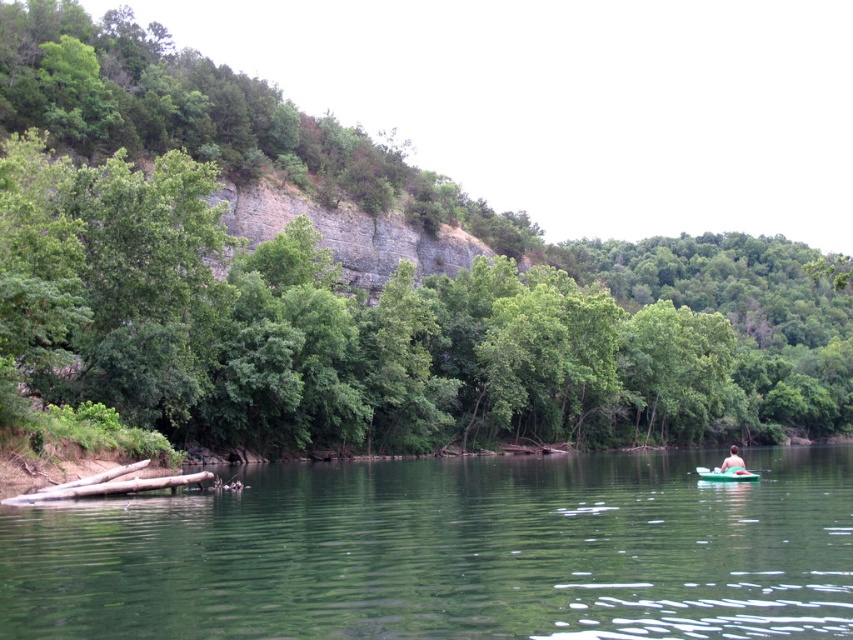
The height and width of the screenshot is (640, 853). What are the coordinates of `green leafy tree at center` in the screenshot? It's located at (357, 296).

Is point (775, 248) closer to camera compared to point (729, 470)?

No, it is not.

Who is more forward, [445,184] or [744,472]?

Point [744,472] is more forward.

Where is `green leafy tree at center`? The height and width of the screenshot is (640, 853). green leafy tree at center is located at coordinates (357, 296).

Is green leafy tree at center to the left of green smooth water at center from the viewer's perspective?

Incorrect, green leafy tree at center is not on the left side of green smooth water at center.

At what (x,y) coordinates should I click in order to perform the action: click on green leafy tree at center. Please return your answer as a coordinate pair (x, y). Looking at the image, I should click on (357, 296).

Does point (730, 467) lie in front of point (730, 468)?

That is True.

Is green plastic canoe at lower right shorter than pink fabric kayak at lower right?

Yes.

Based on the photo, who is more distant from viewer, (711,474) or (729,454)?

Point (729,454)

The image size is (853, 640). In order to click on green plastic canoe at lower right in this screenshot , I will do `click(724, 474)`.